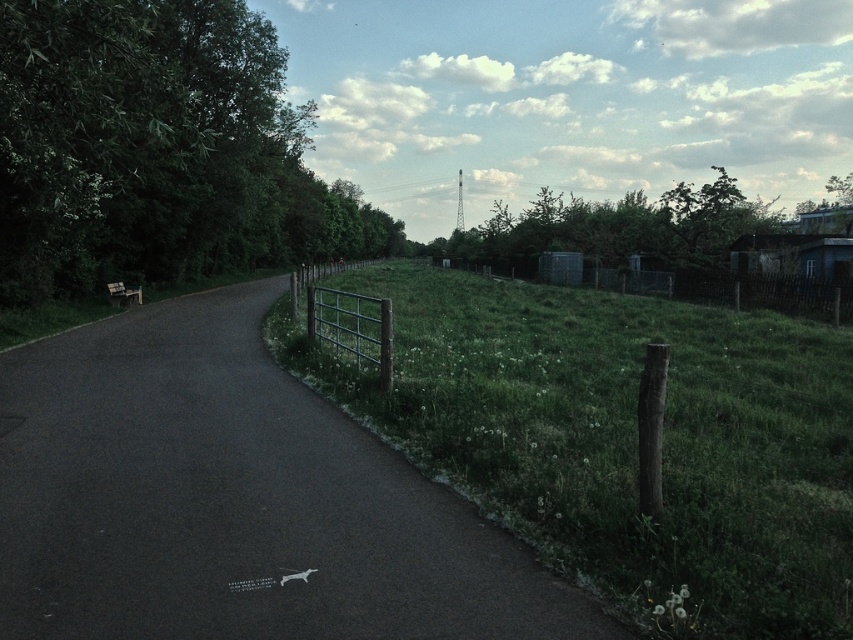
Question: In this image, where is green leafy tree at center located relative to green painted metal gate at center?

Choices:
 (A) right
 (B) left

Answer: (A)

Question: Considering the real-world distances, which object is farthest from the dark asphalt road at center?

Choices:
 (A) green painted metal gate at center
 (B) green grassy at center

Answer: (B)

Question: From the image, what is the correct spatial relationship of green grassy at center in relation to green leafy tree at center?

Choices:
 (A) above
 (B) below

Answer: (B)

Question: Which object appears farthest from the camera in this image?

Choices:
 (A) dark asphalt road at center
 (B) green leafy tree at center
 (C) green leafy tree at left
 (D) green grassy at center

Answer: (B)

Question: Can you confirm if green leafy tree at left is positioned to the right of green painted metal gate at center?

Choices:
 (A) yes
 (B) no

Answer: (B)

Question: Which point is farther to the camera?

Choices:
 (A) (466, 627)
 (B) (589, 209)
 (C) (509, 388)
 (D) (376, 360)

Answer: (B)